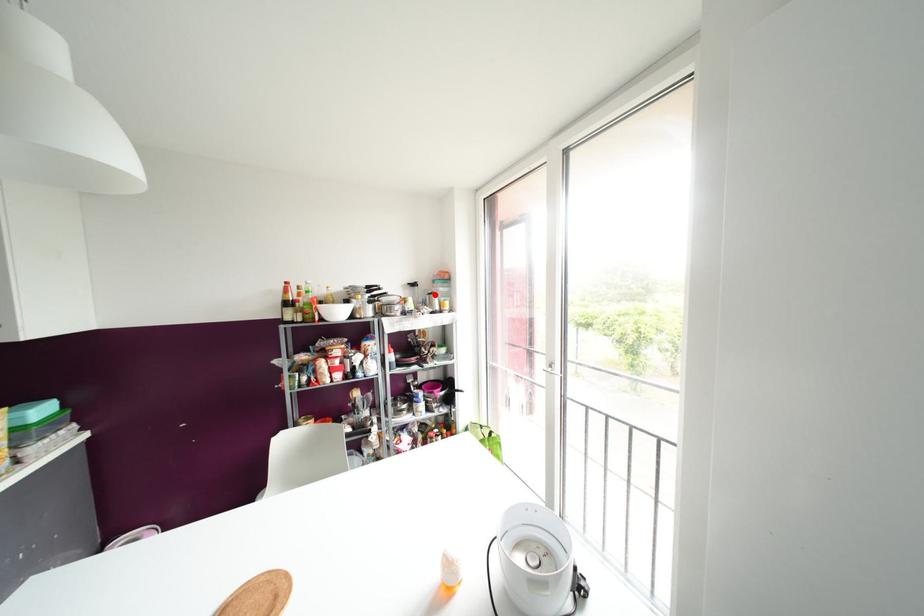
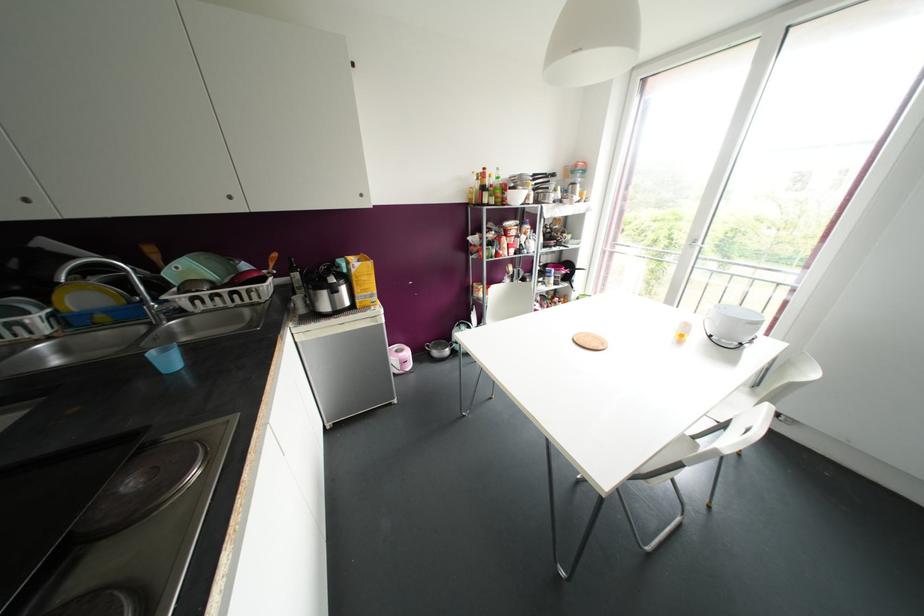
Question: I am providing you with two images of the same scene from different viewpoints. Given a red point in image1, look at the same physical point in image2. Is it:

Choices:
 (A) Closer to the viewpoint
 (B) Farther from the viewpoint

Answer: (A)